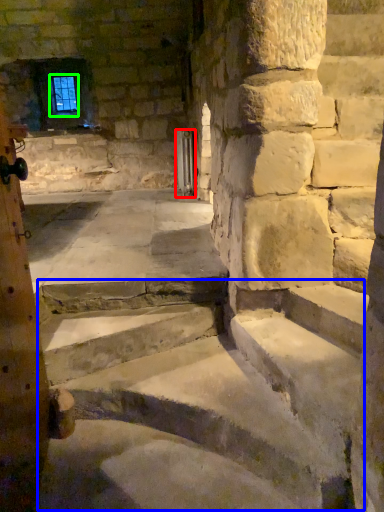
Question: Which object is positioned farthest from door (highlighted by a red box)? Select from stairwell (highlighted by a blue box) and window screen (highlighted by a green box).

Choices:
 (A) stairwell
 (B) window screen

Answer: (A)